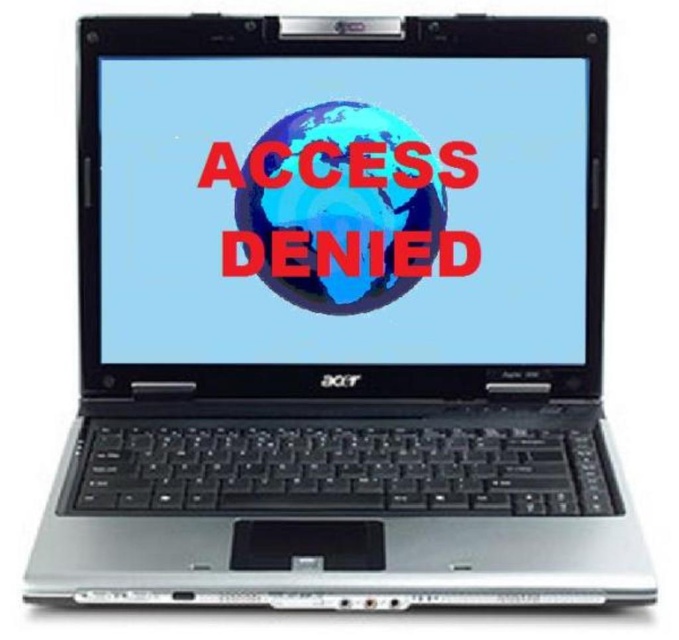
Is point (275, 74) positioned behind point (287, 291)?

No.

Locate an element on the screen. The height and width of the screenshot is (640, 679). matte plastic screen at center is located at coordinates (344, 209).

Is point (495, 115) farther from camera compared to point (346, 269)?

No, it is not.

The width and height of the screenshot is (679, 640). Find the location of `matte plastic screen at center`. matte plastic screen at center is located at coordinates (344, 209).